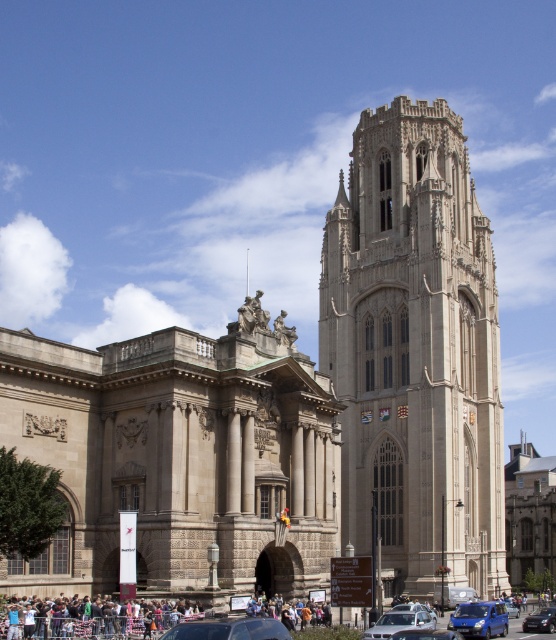
You are driving a metallic blue sedan at lower right and want to park it next to the beige stone tower at center. Is there enough space for the sedan to fit alongside the tower?

The beige stone tower at center might be wider than metallic blue sedan at lower right, so there is a possibility that the sedan may not have enough space to park alongside the tower. It is recommended to check the exact dimensions before attempting to park.

You are a photographer planning to capture the grand classical building and Gothic tower in the background. You notice the multicolored fabric crowd at lower center and the blue matte van at lower right in your shot. Which object should you move to ensure the classical building and Gothic tower are fully visible?

The multicolored fabric crowd at lower center is in front of the blue matte van at lower right. To ensure the classical building and Gothic tower in the background are fully visible, you should move the multicolored fabric crowd at lower center out of the way since it is blocking the view towards the background structures.